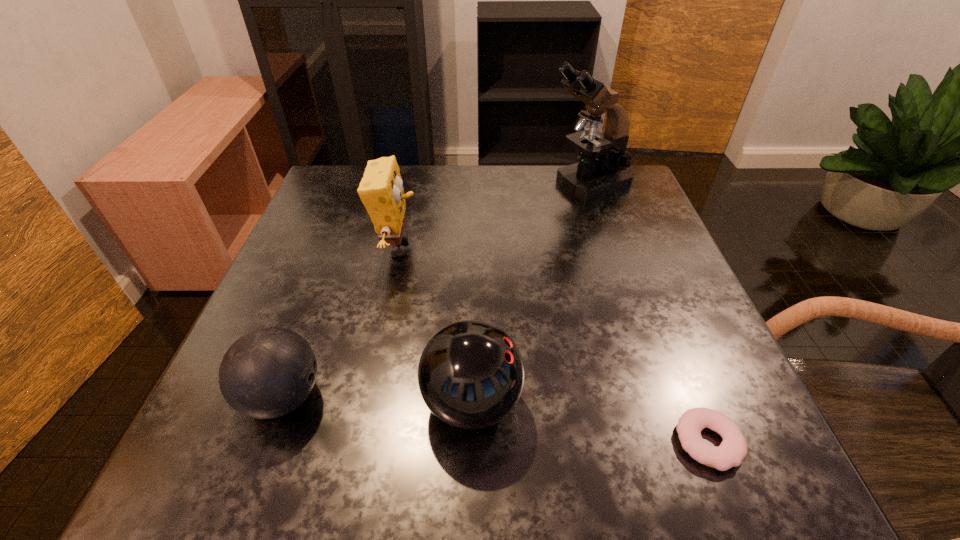
This screenshot has height=540, width=960. What are the coordinates of `microscope` in the screenshot? It's located at point(601,170).

The image size is (960, 540). I want to click on the farthest object, so click(601, 170).

At what (x,y) coordinates should I click in order to perform the action: click on the second farthest object. Please return your answer as a coordinate pair (x, y). Looking at the image, I should click on (381, 191).

At what (x,y) coordinates should I click in order to perform the action: click on the second tallest object. Please return your answer as a coordinate pair (x, y). Looking at the image, I should click on (381, 191).

This screenshot has width=960, height=540. Find the location of `the third object from right to left`. the third object from right to left is located at coordinates (471, 374).

This screenshot has height=540, width=960. Identify the location of the left bowling ball. (269, 372).

The image size is (960, 540). Identify the location of the shorter bowling ball. (269, 372).

Where is `doughnut`? The width and height of the screenshot is (960, 540). doughnut is located at coordinates (733, 449).

At what (x,y) coordinates should I click in order to perform the action: click on free space located on the front of the tallest object. Please return your answer as a coordinate pair (x, y). Looking at the image, I should click on (609, 247).

This screenshot has height=540, width=960. I want to click on vacant space located 0.360m on the face of the sponge, so click(587, 248).